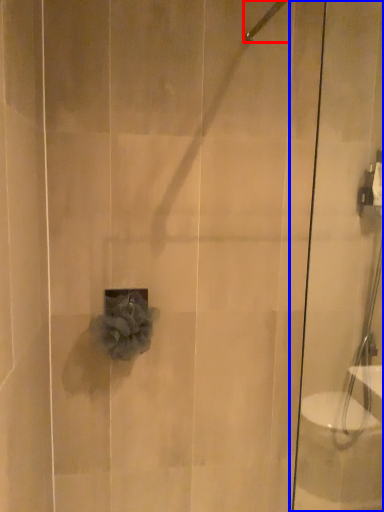
Question: Which point is closer to the camera, shower (highlighted by a red box) or shower door (highlighted by a blue box)?

Choices:
 (A) shower
 (B) shower door

Answer: (B)